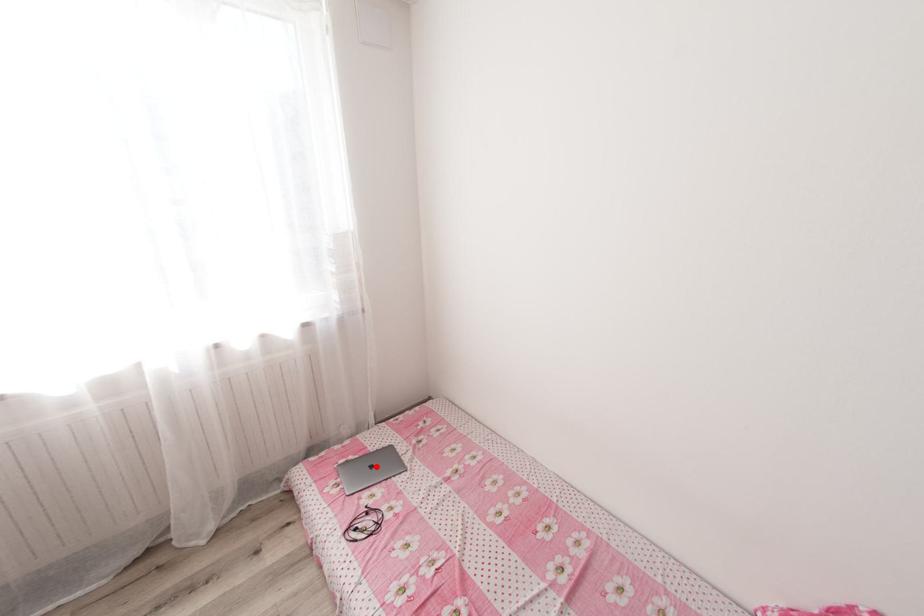
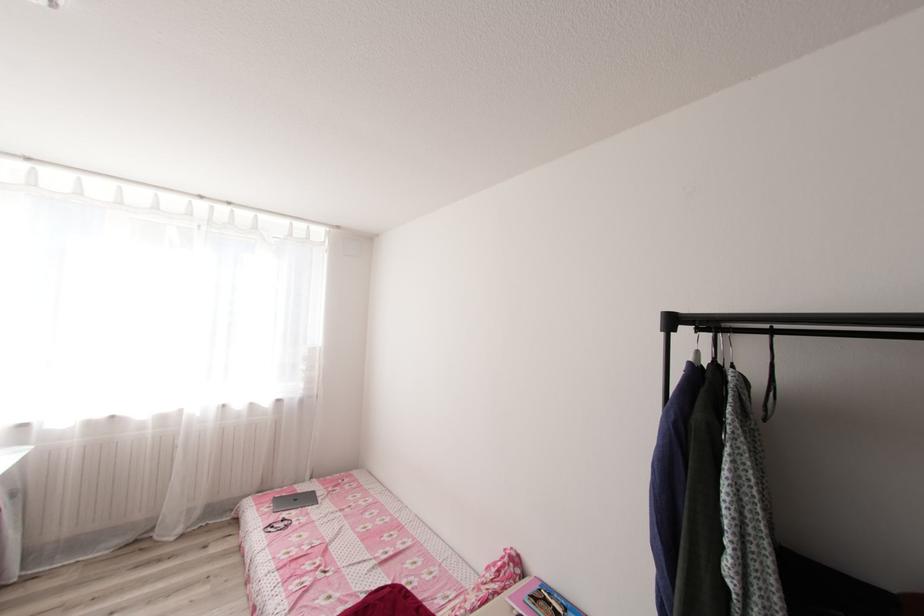
The point at the highlighted location is marked in the first image. Where is the corresponding point in the second image?

(300, 499)